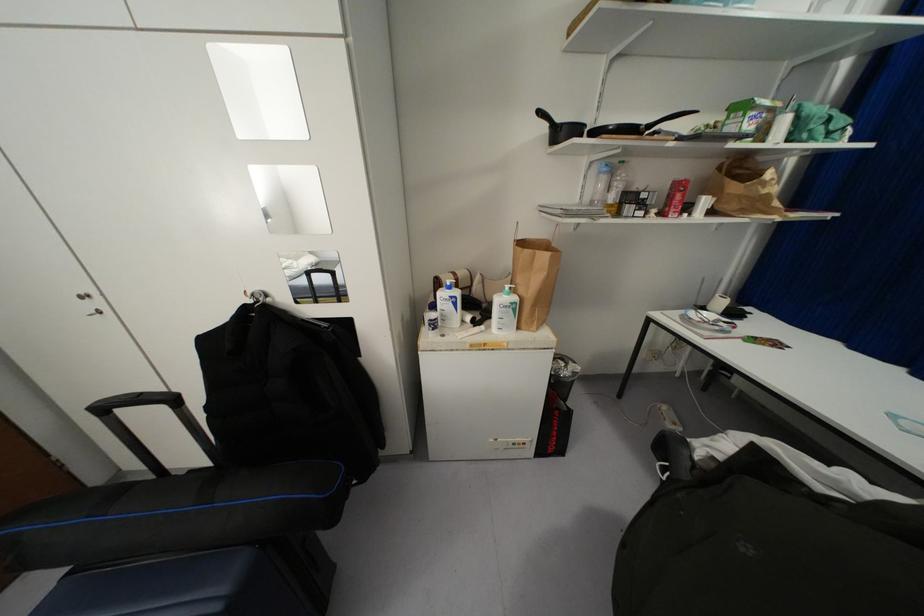
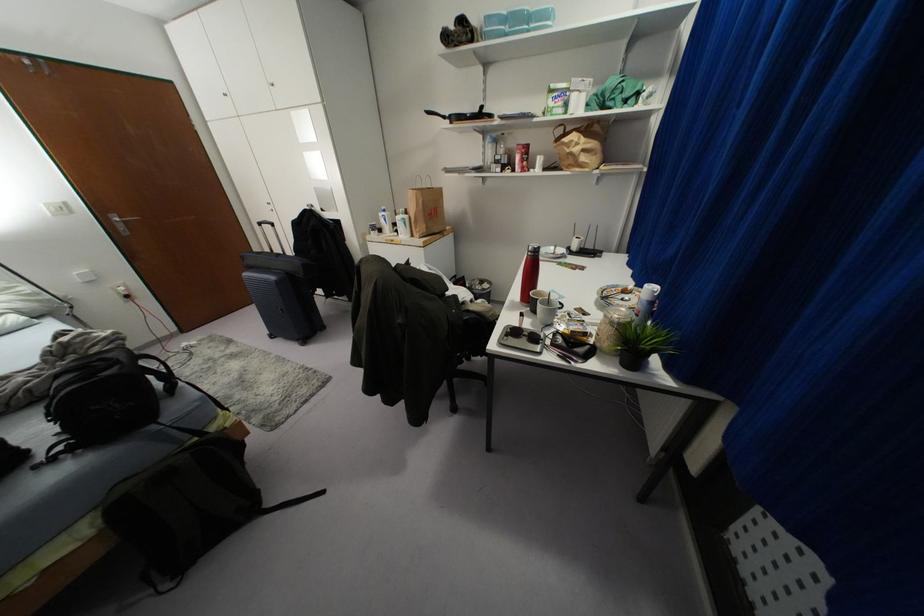
In a continuous first-person perspective shot, in which direction is the camera moving?

The cameraman walked toward right, backward.